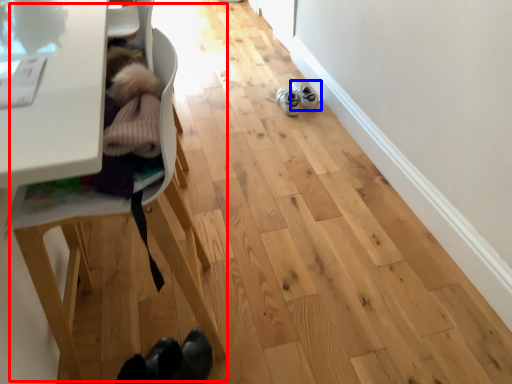
Question: Which point is closer to the camera, baby carriage (highlighted by a red box) or footwear (highlighted by a blue box)?

Choices:
 (A) baby carriage
 (B) footwear

Answer: (A)